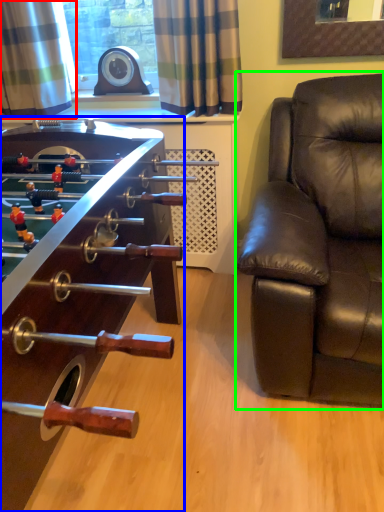
Question: Based on their relative distances, which object is farther from curtain (highlighted by a red box)? Choose from table (highlighted by a blue box) and studio couch (highlighted by a green box).

Choices:
 (A) table
 (B) studio couch

Answer: (B)